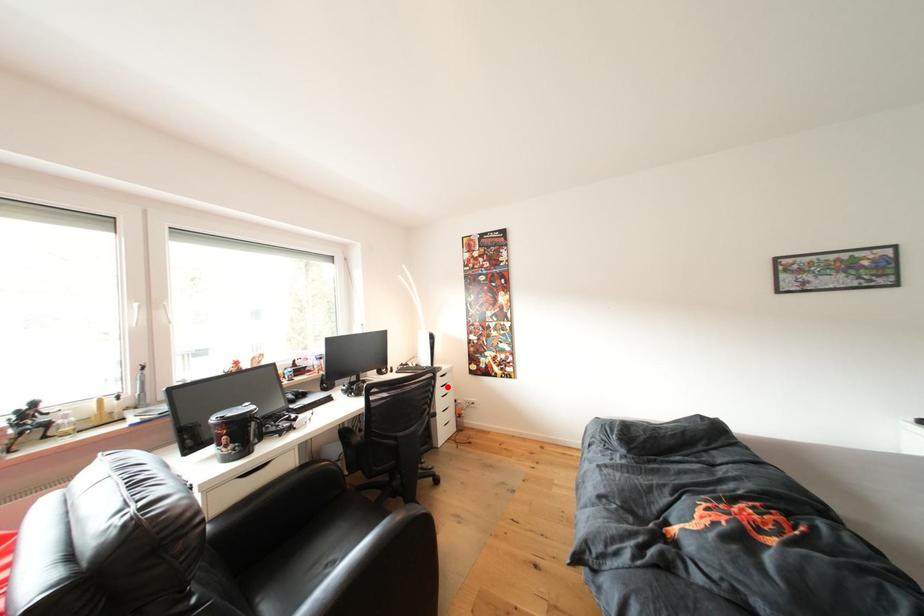
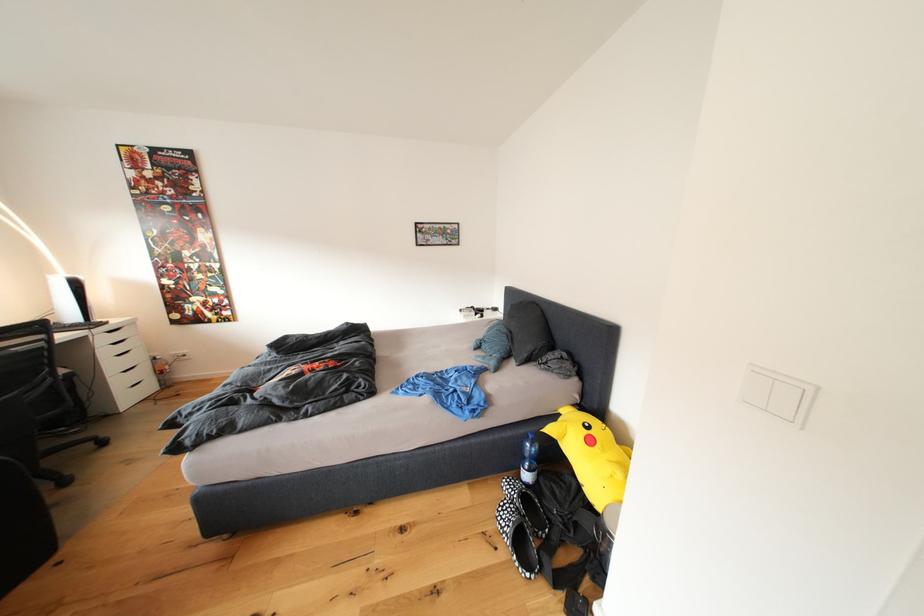
Question: I am providing you with two images of the same scene from different viewpoints. A red point is shown in image1. For the corresponding object point in image2, is it positioned nearer or farther from the camera?

Choices:
 (A) Nearer
 (B) Farther

Answer: (B)